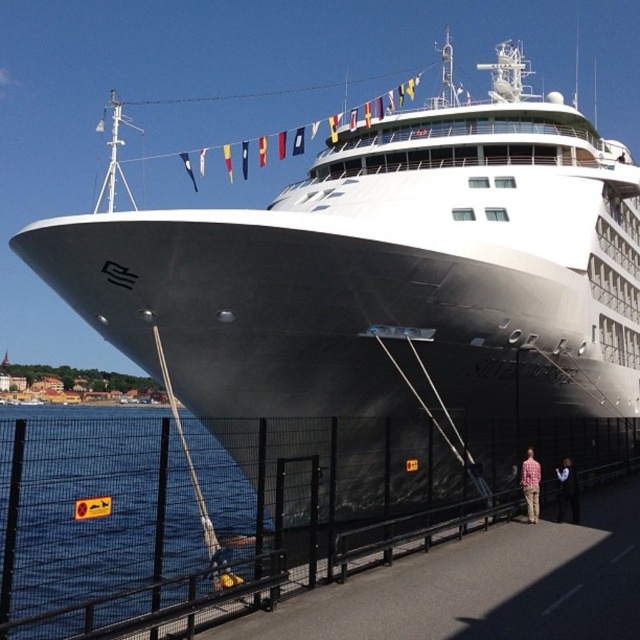
Which of these two, blue water at lower left or plaid shirt at lower right, stands taller?

blue water at lower left

Is blue water at lower left to the left of plaid shirt at lower right from the viewer's perspective?

Yes, blue water at lower left is to the left of plaid shirt at lower right.

Does point (125, 422) come in front of point (525, 477)?

Yes, point (125, 422) is in front of point (525, 477).

I want to click on blue water at lower left, so click(x=90, y=508).

Which of these two, black suit at lower right or plaid shirt at lower right, stands taller?

With more height is plaid shirt at lower right.

Between point (563, 465) and point (531, 477), which one is positioned behind?

Positioned behind is point (563, 465).

Where is `black suit at lower right`? Image resolution: width=640 pixels, height=640 pixels. black suit at lower right is located at coordinates (566, 492).

In the scene shown: Is blue water at lower left taller than black suit at lower right?

Yes, blue water at lower left is taller than black suit at lower right.

This screenshot has height=640, width=640. Find the location of `blue water at lower left`. blue water at lower left is located at coordinates (90, 508).